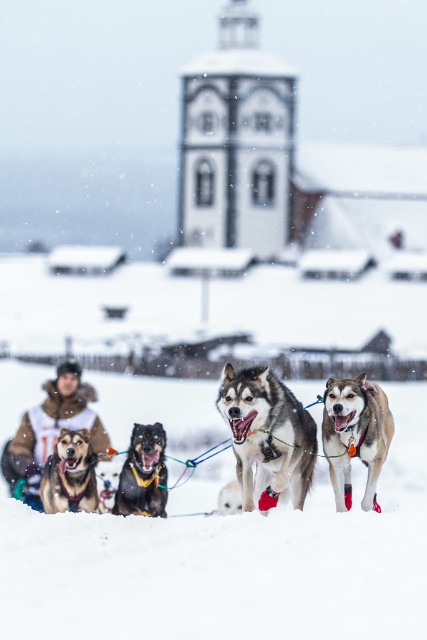
Question: In this image, where is light brown fur at center located relative to black fur dog at center?

Choices:
 (A) below
 (B) above

Answer: (B)

Question: Does white fluffy snow at center appear on the left side of shiny black fur at center?

Choices:
 (A) no
 (B) yes

Answer: (A)

Question: Among these objects, which one is farthest from the camera?

Choices:
 (A) shiny black fur at center
 (B) black fur dog at center
 (C) brown suede jacket at lower left
 (D) white fur dog at center

Answer: (D)

Question: Which object is positioned farthest from the light brown fur at center?

Choices:
 (A) golden fur sled dog at center
 (B) black fur dog at center
 (C) white fluffy snow at center

Answer: (C)

Question: Does shiny black fur at center have a lesser width compared to white fur dog at center?

Choices:
 (A) yes
 (B) no

Answer: (B)

Question: Among these objects, which one is farthest from the camera?

Choices:
 (A) white fluffy snow at center
 (B) light brown fur at center
 (C) golden fur sled dog at center
 (D) shiny black fur at center

Answer: (C)